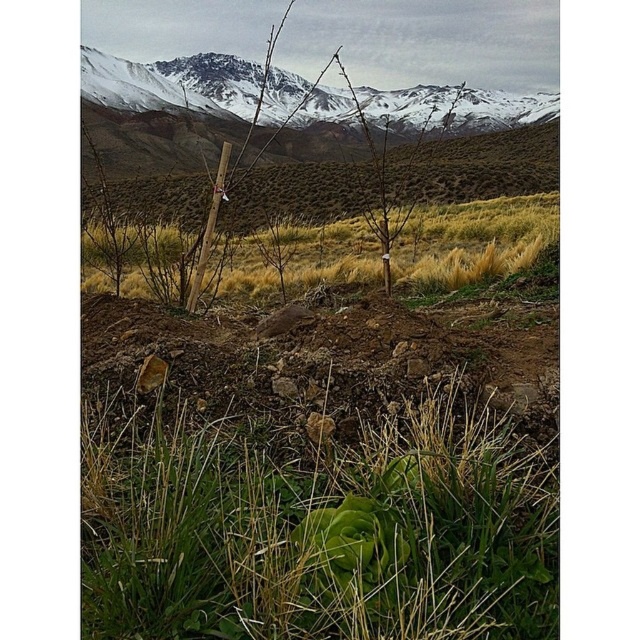
Between dry grass at center and snowy rock mountain at upper center, which one has more height?

Standing taller between the two is snowy rock mountain at upper center.

Based on the photo, who is shorter, dry grass at center or snowy rock mountain at upper center?

With less height is dry grass at center.

Is point (348, 248) behind point (408, 120)?

That is False.

Find the location of a particular element. dry grass at center is located at coordinates (472, 241).

Who is positioned more to the left, green leafy grass at center or snowy rock mountain at upper center?

green leafy grass at center is more to the left.

Is green leafy grass at center above snowy rock mountain at upper center?

No.

Where is `green leafy grass at center`? The image size is (640, 640). green leafy grass at center is located at coordinates (316, 529).

Between green leafy grass at center and dry grass at center, which one has more height?

With more height is dry grass at center.

Between green leafy grass at center and dry grass at center, which one has less height?

green leafy grass at center is shorter.

Is point (541, 625) more distant than point (518, 250)?

No, (541, 625) is closer to viewer.

Identify the location of green leafy grass at center. This screenshot has width=640, height=640. (316, 529).